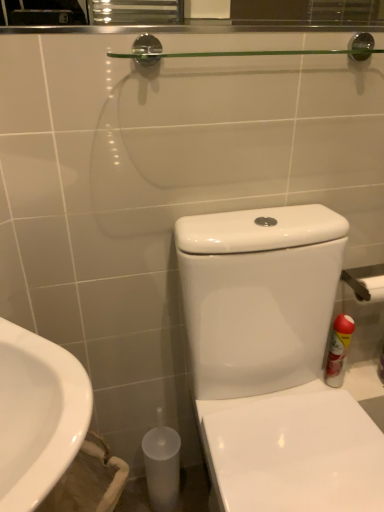
What do you see at coordinates (38, 415) in the screenshot? The height and width of the screenshot is (512, 384). I see `white glossy sink at lower left` at bounding box center [38, 415].

At what (x,y) coordinates should I click in order to perform the action: click on white glossy sink at lower left. Please return your answer as a coordinate pair (x, y). Looking at the image, I should click on (38, 415).

What is the approximate width of red matte spray can at right?

red matte spray can at right is 8.03 centimeters wide.

Where is `white glossy toilet at center`? The image size is (384, 512). white glossy toilet at center is located at coordinates (x=273, y=362).

Locate an element on the screen. The width and height of the screenshot is (384, 512). metallic silver towel bar at right is located at coordinates (366, 282).

What's the angular difference between metallic silver towel bar at right and white glossy sink at lower left's facing directions?

44.1 degrees.

Is metallic silver towel bar at right turned away from white glossy sink at lower left?

No, metallic silver towel bar at right's orientation is not away from white glossy sink at lower left.

Is metallic silver towel bar at right not close to white glossy sink at lower left?

That's not correct — metallic silver towel bar at right is a little close to white glossy sink at lower left.

Would you say white glossy toilet at center is a long distance from white glossy sink at lower left?

white glossy toilet at center is actually quite close to white glossy sink at lower left.

Between white glossy toilet at center and white glossy sink at lower left, which one has less height?

With less height is white glossy sink at lower left.

From a real-world perspective, which is physically below, white glossy toilet at center or white glossy sink at lower left?

In real-world perspective, white glossy toilet at center is lower.

Considering the relative positions of red matte spray can at right and white glossy toilet at center in the image provided, is red matte spray can at right to the left of white glossy toilet at center from the viewer's perspective?

→ No, red matte spray can at right is not to the left of white glossy toilet at center.

Does red matte spray can at right lie behind white glossy toilet at center?

Yes, red matte spray can at right is further from the viewer.

Based on the photo, is red matte spray can at right surrounding white glossy toilet at center?

No, white glossy toilet at center is not inside red matte spray can at right.

You are a GUI agent. You are given a task and a screenshot of the screen. Output one action in this format:
    pyautogui.click(x=<x>, y=<y>)
    Task: Click on the cleaning product that appears behind the white glossy toilet at center
    
    Given the screenshot: What is the action you would take?
    pyautogui.click(x=339, y=350)

Based on the photo, relative to metallic silver towel bar at right, is white glossy sink at lower left in front or behind?

Visually, white glossy sink at lower left is located in front of metallic silver towel bar at right.

Consider the image. Which object is positioned more to the left, white glossy sink at lower left or metallic silver towel bar at right?

white glossy sink at lower left.

Is metallic silver towel bar at right inside white glossy sink at lower left?

Definitely not — metallic silver towel bar at right is not inside white glossy sink at lower left.

Measure the distance from white glossy sink at lower left to metallic silver towel bar at right.

They are 31.25 inches apart.

Considering the relative positions of metallic silver towel bar at right and red matte spray can at right in the image provided, is metallic silver towel bar at right to the left or to the right of red matte spray can at right?

In the image, metallic silver towel bar at right appears on the right side of red matte spray can at right.

How many degrees apart are the facing directions of metallic silver towel bar at right and red matte spray can at right?

metallic silver towel bar at right and red matte spray can at right are facing 0.000486 degrees away from each other.

Is metallic silver towel bar at right turned away from red matte spray can at right?

That's not correct — metallic silver towel bar at right is not looking away from red matte spray can at right.

How far apart are metallic silver towel bar at right and red matte spray can at right?

6.27 inches.

Could metallic silver towel bar at right be considered to be inside white glossy toilet at center?

No, metallic silver towel bar at right is located outside of white glossy toilet at center.

Can you confirm if white glossy toilet at center is taller than metallic silver towel bar at right?

Indeed, white glossy toilet at center has a greater height compared to metallic silver towel bar at right.

From a real-world perspective, which object rests below the other?

In real-world perspective, white glossy toilet at center is lower.

Considering the relative sizes of white glossy toilet at center and metallic silver towel bar at right in the image provided, is white glossy toilet at center wider than metallic silver towel bar at right?

Yes.

Is white glossy sink at lower left turned away from red matte spray can at right?

That's not correct — white glossy sink at lower left is not looking away from red matte spray can at right.

Does white glossy sink at lower left have a lesser width compared to red matte spray can at right?

No.

From a real-world perspective, which is physically above, white glossy sink at lower left or red matte spray can at right?

white glossy sink at lower left.

From the image's perspective, relative to red matte spray can at right, is white glossy sink at lower left above or below?

white glossy sink at lower left is below red matte spray can at right.

In order to click on towel bar above the white glossy sink at lower left (from the image's perspective) in this screenshot , I will do [x=366, y=282].

You are a GUI agent. You are given a task and a screenshot of the screen. Output one action in this format:
    pyautogui.click(x=<x>, y=<y>)
    Task: Click on the sink on the left of white glossy toilet at center
    This screenshot has height=512, width=384.
    Given the screenshot: What is the action you would take?
    pyautogui.click(x=38, y=415)

When comparing their distances from red matte spray can at right, does white glossy sink at lower left or metallic silver towel bar at right seem further?

white glossy sink at lower left.

From the image, which object appears to be farther from metallic silver towel bar at right, white glossy toilet at center or white glossy sink at lower left?

Among the two, white glossy sink at lower left is located further to metallic silver towel bar at right.

Looking at the image, which one is located closer to white glossy toilet at center, white glossy sink at lower left or red matte spray can at right?

red matte spray can at right lies closer to white glossy toilet at center than the other object.

Considering their positions, is red matte spray can at right positioned closer to metallic silver towel bar at right than white glossy sink at lower left?

The object closer to metallic silver towel bar at right is red matte spray can at right.

Based on their spatial positions, is red matte spray can at right or metallic silver towel bar at right closer to white glossy sink at lower left?

metallic silver towel bar at right is closer to white glossy sink at lower left.

Looking at the image, which one is located closer to white glossy sink at lower left, red matte spray can at right or white glossy toilet at center?

white glossy toilet at center is positioned closer to the anchor white glossy sink at lower left.

Consider the image. Which object lies nearer to the anchor point white glossy toilet at center, metallic silver towel bar at right or red matte spray can at right?

Based on the image, red matte spray can at right appears to be nearer to white glossy toilet at center.

Which object lies nearer to the anchor point white glossy sink at lower left, white glossy toilet at center or metallic silver towel bar at right?

Based on the image, white glossy toilet at center appears to be nearer to white glossy sink at lower left.

In order to click on toilet situated between white glossy sink at lower left and metallic silver towel bar at right from left to right in this screenshot , I will do `click(273, 362)`.

Where is `sink located between white glossy toilet at center and red matte spray can at right in the depth direction`? Image resolution: width=384 pixels, height=512 pixels. sink located between white glossy toilet at center and red matte spray can at right in the depth direction is located at coordinates (38, 415).

Locate an element on the screen. The image size is (384, 512). cleaning product located between white glossy sink at lower left and metallic silver towel bar at right in the left-right direction is located at coordinates (339, 350).

I want to click on towel bar located between white glossy toilet at center and red matte spray can at right in the depth direction, so click(366, 282).